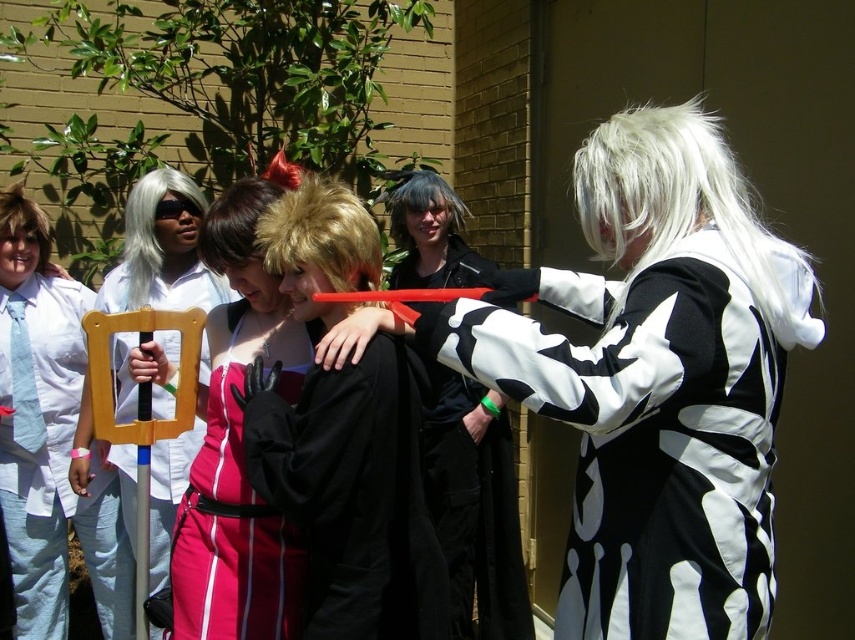
Does white matte wig at upper right appear on the left side of matte white wig at left?

No, white matte wig at upper right is not to the left of matte white wig at left.

Is white matte wig at upper right below matte white wig at left?

No, white matte wig at upper right is not below matte white wig at left.

The width and height of the screenshot is (855, 640). Find the location of `white matte wig at upper right`. white matte wig at upper right is located at coordinates (685, 209).

What do you see at coordinates (150, 227) in the screenshot?
I see `gray synthetic wig at upper left` at bounding box center [150, 227].

In order to click on gray synthetic wig at upper left in this screenshot , I will do `click(150, 227)`.

Who is lower down, light blue fabric shirt at left or black matte robe at center?

black matte robe at center

Which is in front, point (16, 506) or point (457, 284)?

Point (16, 506)

Identify the location of light blue fabric shirt at left. This screenshot has width=855, height=640. (43, 426).